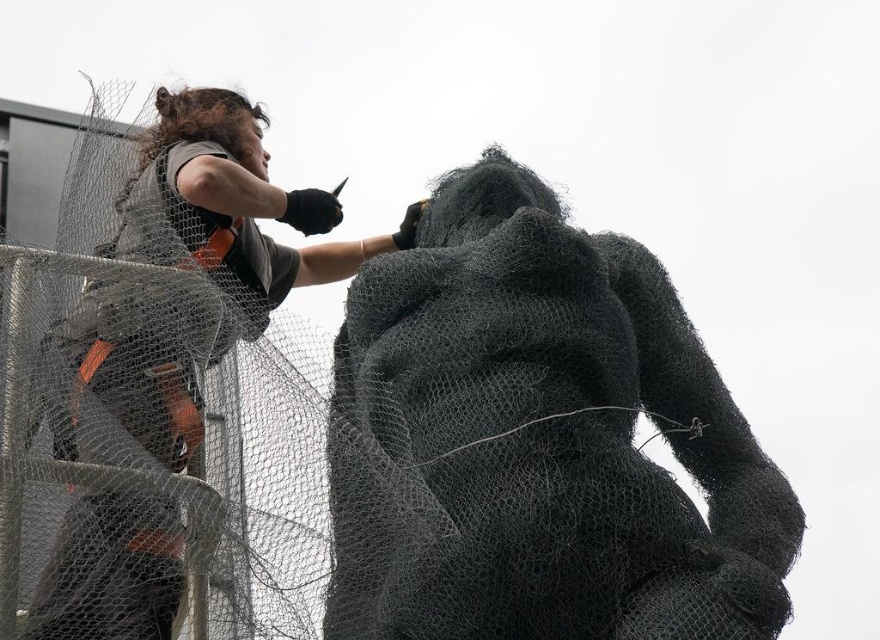
Who is more forward, (629, 452) or (206, 108)?

Point (629, 452) is more forward.

Measure the distance between textured wire mesh gorilla at center and camera.

textured wire mesh gorilla at center and camera are 54.58 meters apart.

Between point (343, 548) and point (72, 349), which one is positioned in front?

Positioned in front is point (72, 349).

Locate an element on the screen. textured wire mesh gorilla at center is located at coordinates (539, 440).